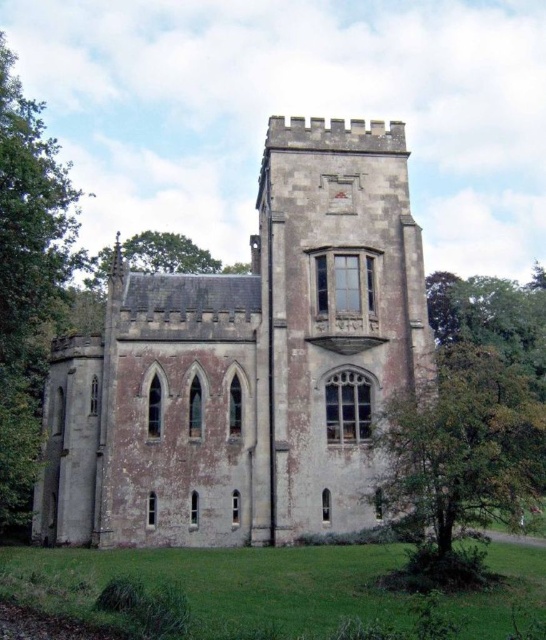
Can you confirm if green leafy tree at right is wider than green leafy tree at left?

No, green leafy tree at right is not wider than green leafy tree at left.

Which is more to the left, green leafy tree at right or green leafy tree at left?

green leafy tree at left is more to the left.

Locate an element on the screen. The width and height of the screenshot is (546, 640). green leafy tree at right is located at coordinates (460, 458).

Does gray stone castle at center have a greater width compared to green leafy tree at right?

Yes.

Is gray stone castle at center in front of green leafy tree at right?

No, gray stone castle at center is behind green leafy tree at right.

At what (x,y) coordinates should I click in order to perform the action: click on gray stone castle at center. Please return your answer as a coordinate pair (x, y). The image size is (546, 640). Looking at the image, I should click on (247, 364).

Can you confirm if gray stone castle at center is thinner than green leafy tree at left?

Indeed, gray stone castle at center has a lesser width compared to green leafy tree at left.

Does point (117, 356) lie in front of point (61, 236)?

No, it is not.

Identify the location of gray stone castle at center. The width and height of the screenshot is (546, 640). click(247, 364).